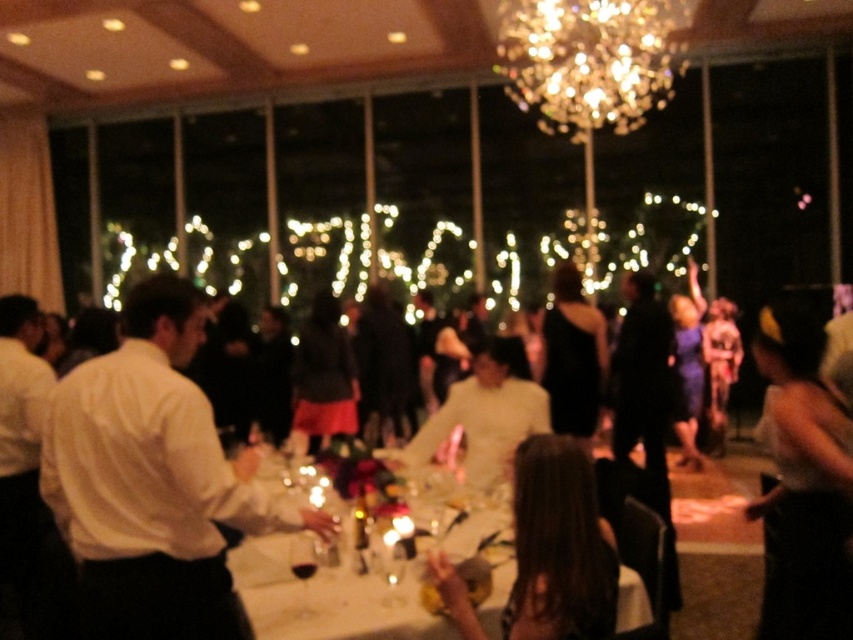
Question: Does sparkling crystal chandelier at upper center have a larger size compared to white glossy table at center?

Choices:
 (A) yes
 (B) no

Answer: (A)

Question: Which point is closer to the camera?

Choices:
 (A) (198, 592)
 (B) (813, 342)
 (C) (392, 612)
 (D) (688, 524)

Answer: (A)

Question: Estimate the real-world distances between objects in this image. Which object is closer to the white glossy table at center?

Choices:
 (A) dark brown hair at center
 (B) white shirt at left
 (C) black satin dress at lower right
 (D) transparent glass wine at lower center

Answer: (D)

Question: Which point appears farthest from the camera in this image?

Choices:
 (A) (112, 604)
 (B) (578, 56)
 (C) (596, 564)

Answer: (B)

Question: Does black satin dress at lower right appear under white glossy table at center?

Choices:
 (A) yes
 (B) no

Answer: (B)

Question: Is dark brown hair at center further to camera compared to transparent glass wine at lower center?

Choices:
 (A) yes
 (B) no

Answer: (B)